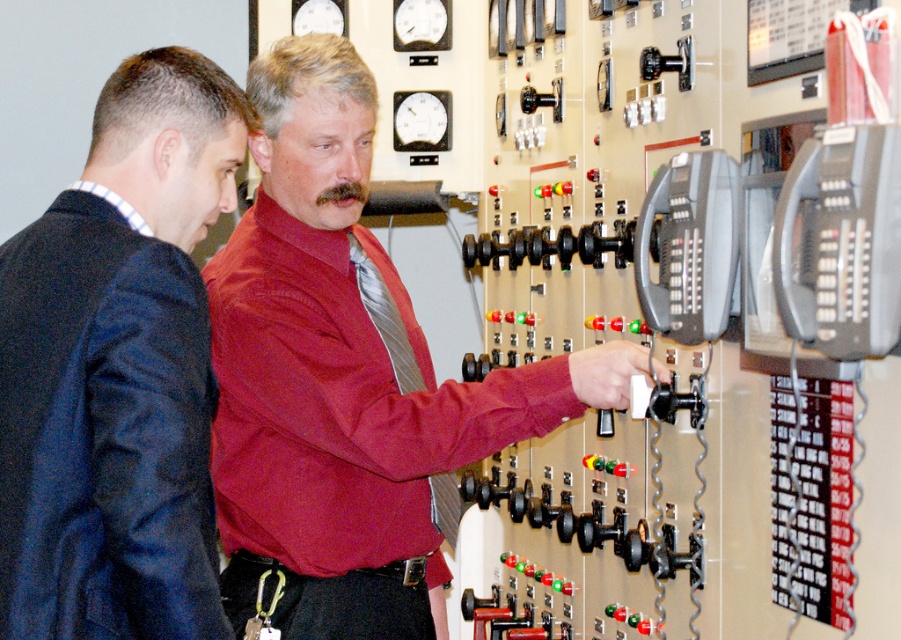
Question: Among these objects, which one is nearest to the camera?

Choices:
 (A) matte red shirt at center
 (B) dark blue suit at left
 (C) silky silver tie at center

Answer: (B)

Question: Is dark blue suit at left above silky silver tie at center?

Choices:
 (A) no
 (B) yes

Answer: (B)

Question: Based on their relative distances, which object is farther from the dark blue suit at left?

Choices:
 (A) matte red shirt at center
 (B) silky silver tie at center

Answer: (B)

Question: Does dark blue suit at left appear on the left side of silky silver tie at center?

Choices:
 (A) yes
 (B) no

Answer: (A)

Question: Among these objects, which one is nearest to the camera?

Choices:
 (A) silky silver tie at center
 (B) dark blue suit at left

Answer: (B)

Question: Can you confirm if dark blue suit at left is wider than silky silver tie at center?

Choices:
 (A) yes
 (B) no

Answer: (A)